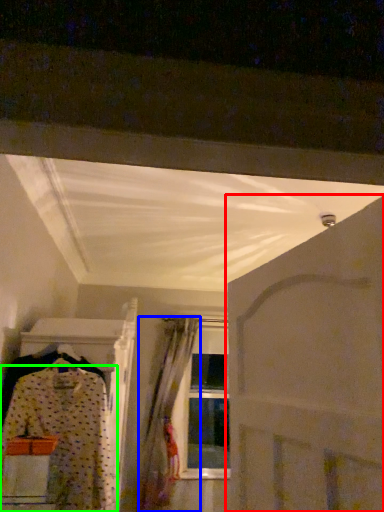
Question: Considering the real-world distances, which object is closest to door (highlighted by a red box)? curtain (highlighted by a blue box) or fancy dress (highlighted by a green box).

Choices:
 (A) curtain
 (B) fancy dress

Answer: (B)